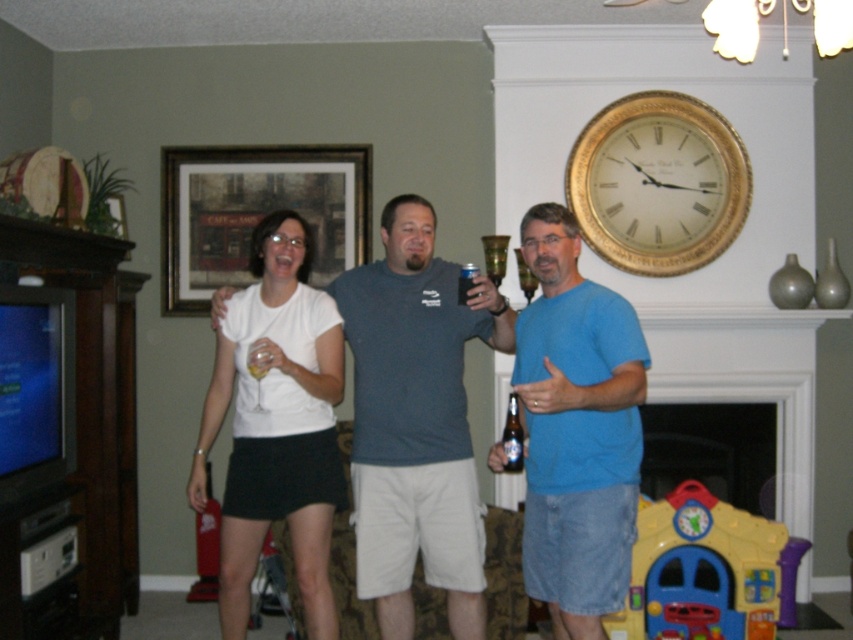
Question: Does blue denim shorts at center have a lesser width compared to plastic yellow playhouse at lower right?

Choices:
 (A) no
 (B) yes

Answer: (B)

Question: Can you confirm if white matte picture frame at upper center is thinner than clear glass bottle at center?

Choices:
 (A) yes
 (B) no

Answer: (B)

Question: From the image, what is the correct spatial relationship of white matte picture frame at upper center in relation to metallic can at center?

Choices:
 (A) below
 (B) above

Answer: (B)

Question: Estimate the real-world distances between objects in this image. Which object is closer to the white matte picture frame at upper center?

Choices:
 (A) gold/gilded clock at upper center
 (B) metallic can at center
 (C) matte gray t-shirt at center
 (D) plastic yellow playhouse at lower right

Answer: (A)

Question: Which of the following is the farthest from the observer?

Choices:
 (A) white matte picture frame at upper center
 (B) clear glass bottle at center

Answer: (A)

Question: Which of these objects is positioned closest to the clear glass bottle at center?

Choices:
 (A) blue denim shorts at center
 (B) gold/gilded clock at upper center
 (C) matte gray t-shirt at center

Answer: (A)